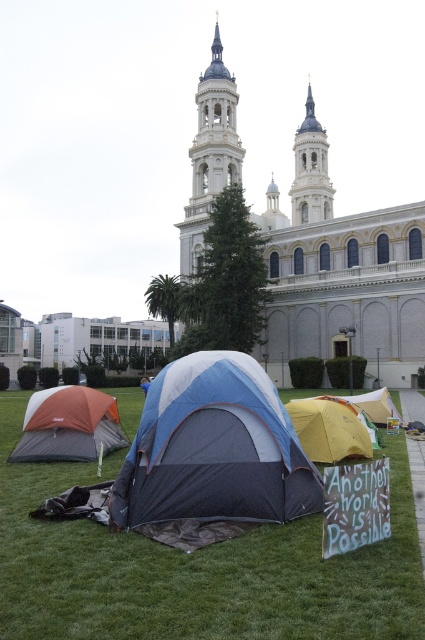
Who is more distant from viewer, (x=212, y=154) or (x=371, y=449)?

Positioned behind is point (x=212, y=154).

Between point (359, 342) and point (345, 452), which one is positioned in front?

Point (345, 452)

Locate an element on the screen. white stone church at center is located at coordinates (340, 272).

Consider the image. Between green grass at center and blue/gray fabric tent at center, which one has more height?

With more height is blue/gray fabric tent at center.

Is green grass at center to the left of blue/gray fabric tent at center from the viewer's perspective?

Yes, green grass at center is to the left of blue/gray fabric tent at center.

Is point (172, 588) farther from viewer compared to point (178, 504)?

No.

The height and width of the screenshot is (640, 425). Identify the location of green grass at center. (195, 570).

Does point (99, 390) come farther from viewer compared to point (374, 410)?

That is True.

You are a GUI agent. You are given a task and a screenshot of the screen. Output one action in this format:
    pyautogui.click(x=<x>, y=<y>)
    Task: Click on the orange fabric tent at lower left
    This screenshot has height=640, width=425.
    Given the screenshot: What is the action you would take?
    pyautogui.click(x=68, y=426)